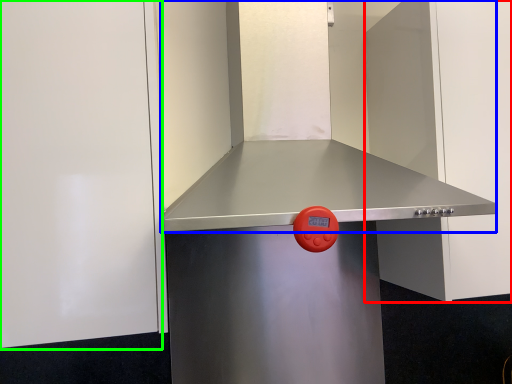
Question: Which object is the farthest from door (highlighted by a red box)? Choose among these: vent (highlighted by a blue box) or door (highlighted by a green box).

Choices:
 (A) vent
 (B) door

Answer: (B)